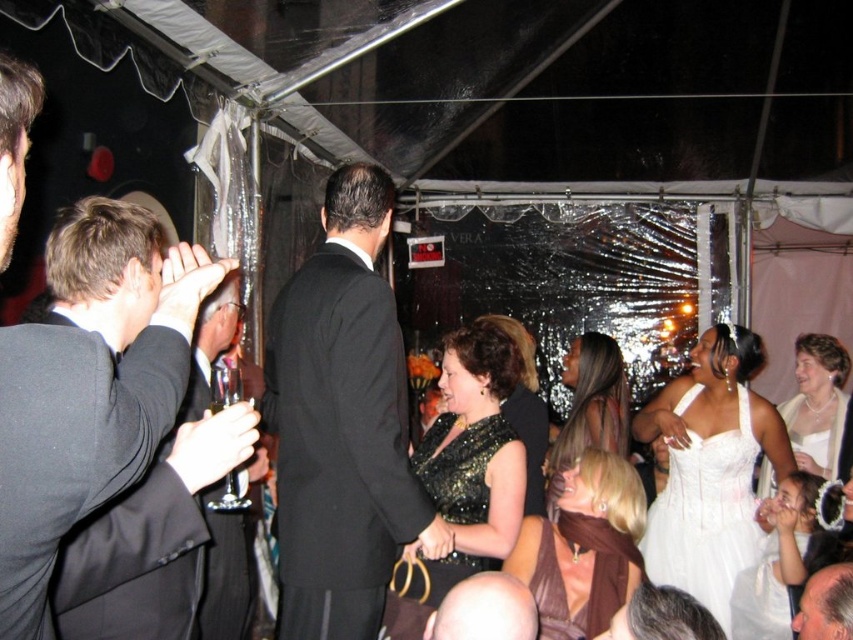
You are a photographer at the event and want to capture a photo of the brown satin dress at lower center and the gray hair at center. Based on their positions, which object should you focus on first if you are moving from the right side of the scene towards the center?

The brown satin dress at lower center should be focused on first because it is located to the left of the gray hair at center, so when moving from the right, you would encounter the brown satin dress at lower center before reaching the gray hair at center.

You are a photographer at the event and need to capture a photo of the brown satin dress at lower center and the gray hair at center. Since the lighting is dim, you want to ensure both subjects are fully visible. Which subject should you focus on first to ensure proper exposure?

The brown satin dress at lower center is taller than the gray hair at center, so focusing on the brown satin dress at lower center first will ensure proper exposure as it occupies more space in the frame.